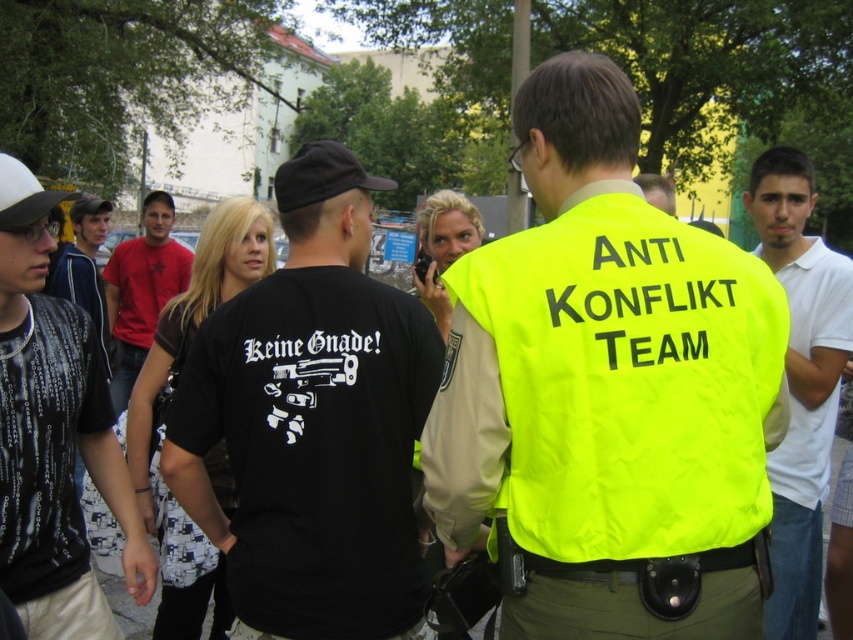
You are a member of the ANTI KONFLIKT TEAM and need to communicate with the person wearing the white cotton shirt at right. Your radio has a maximum range of 2.5 meters. Can you reach them without moving?

The white cotton shirt at right and viewer are 2.62 meters apart, so the radio cannot reach them since it only has a 2.5 meter range. You need to move closer.